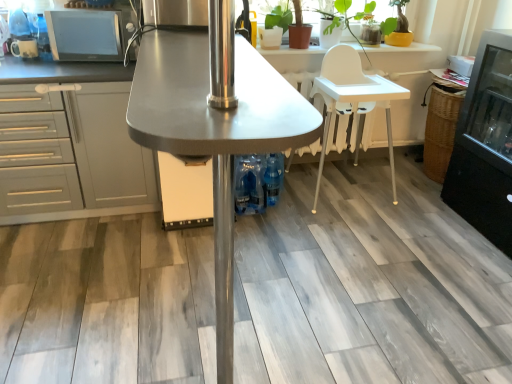
Where is `vacant space that's between metallic gray table at center, positioned as the 2th table in right-to-left order, and gray matte cabinet at left`? This screenshot has height=384, width=512. vacant space that's between metallic gray table at center, positioned as the 2th table in right-to-left order, and gray matte cabinet at left is located at coordinates (89, 290).